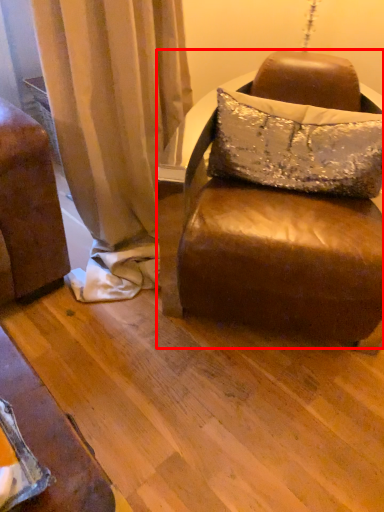
Question: In this image, where is studio couch (annotated by the red box) located relative to pillow?

Choices:
 (A) right
 (B) left

Answer: (B)